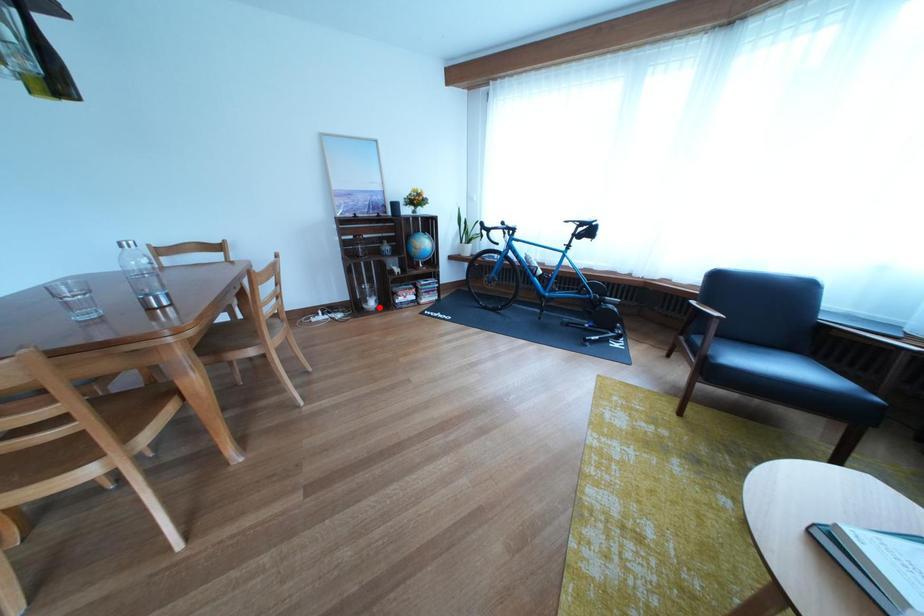
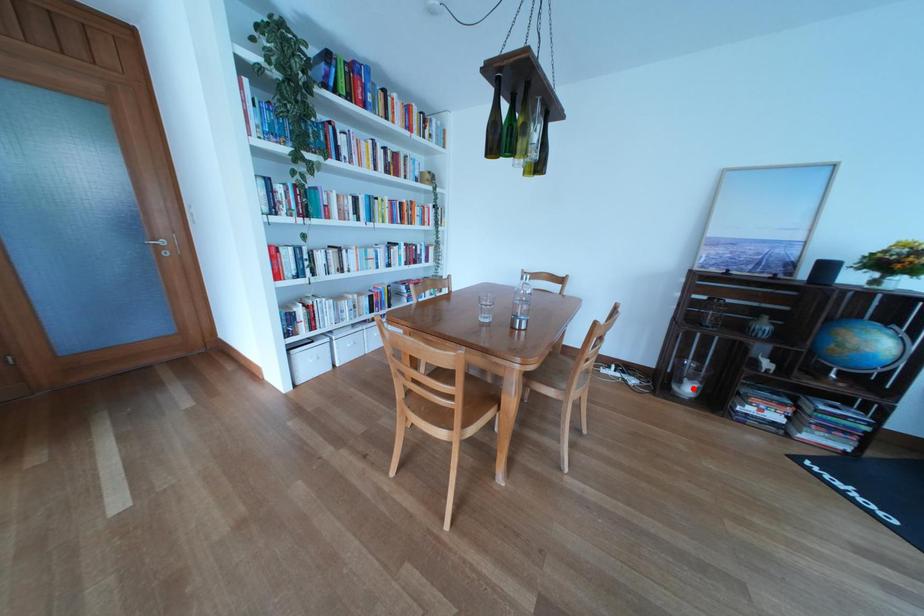
I am providing you with two images of the same scene from different viewpoints. A red point is marked on the first image and another point is marked on the second image. Do the highlighted points in image1 and image2 indicate the same real-world spot?

Yes